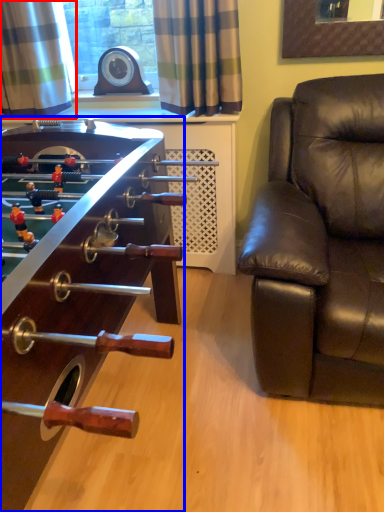
Question: Which object is further to the camera taking this photo, curtain (highlighted by a red box) or table (highlighted by a blue box)?

Choices:
 (A) curtain
 (B) table

Answer: (A)